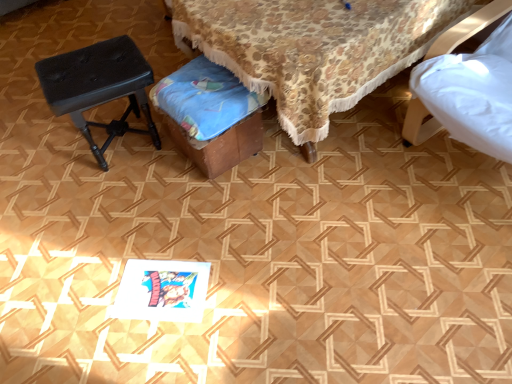
This screenshot has height=384, width=512. What do you see at coordinates (210, 115) in the screenshot?
I see `wooden music stool at center` at bounding box center [210, 115].

This screenshot has height=384, width=512. In order to click on black leather stool at left in this screenshot , I will do `click(99, 87)`.

Is wooden music stool at center positioned beyond the bounds of black leather stool at left?

Yes, wooden music stool at center is not within black leather stool at left.

Between wooden music stool at center and black leather stool at left, which one is positioned in front?

wooden music stool at center is more forward.

Is wooden music stool at center shorter than black leather stool at left?

Indeed, wooden music stool at center has a lesser height compared to black leather stool at left.

What are the coordinates of `music stool in front of the black leather stool at left` in the screenshot? It's located at (210, 115).

Based on the photo, is black leather stool at left taller or shorter than wooden stool at center?

Clearly, black leather stool at left is shorter compared to wooden stool at center.

Could you tell me if black leather stool at left is facing wooden stool at center?

No, black leather stool at left is not oriented towards wooden stool at center.

From the image's perspective, does black leather stool at left appear lower than wooden stool at center?

Yes.

Consider the image. From a real-world perspective, is black leather stool at left positioned under wooden stool at center based on gravity?

Yes, from a real-world perspective, black leather stool at left is beneath wooden stool at center.

Is point (216, 105) in front of point (243, 77)?

That is False.

In terms of height, does wooden music stool at center look taller or shorter compared to wooden stool at center?

In the image, wooden music stool at center appears to be shorter than wooden stool at center.

Is wooden music stool at center facing away from wooden stool at center?

Yes, wooden music stool at center's orientation is away from wooden stool at center.

Does wooden music stool at center appear on the right side of wooden stool at center?

Incorrect, wooden music stool at center is not on the right side of wooden stool at center.

From their relative heights in the image, would you say wooden stool at center is taller or shorter than wooden music stool at center?

In the image, wooden stool at center appears to be taller than wooden music stool at center.

Looking at the image, does wooden stool at center seem bigger or smaller compared to wooden music stool at center?

In the image, wooden stool at center appears to be larger than wooden music stool at center.

Is wooden stool at center thinner than wooden music stool at center?

No.

Is wooden stool at center taller than black leather stool at left?

Yes.

Is wooden stool at center positioned far away from black leather stool at left?

That's not correct — wooden stool at center is a little close to black leather stool at left.

Looking at this image, is black leather stool at left at the back of wooden stool at center?

That's not correct — wooden stool at center is not looking away from black leather stool at left.

From the image's perspective, which object appears higher, black leather stool at left or wooden music stool at center?

black leather stool at left is shown above in the image.

Can you tell me how much black leather stool at left and wooden music stool at center differ in facing direction?

black leather stool at left and wooden music stool at center are facing 11 degrees away from each other.

Is black leather stool at left aimed at wooden music stool at center?

No, black leather stool at left is not aimed at wooden music stool at center.

Find the location of `stool positioned vertically above the wooden music stool at center (from a real-world perspective)`. stool positioned vertically above the wooden music stool at center (from a real-world perspective) is located at coordinates (99, 87).

You are a GUI agent. You are given a task and a screenshot of the screen. Output one action in this format:
    pyautogui.click(x=<x>, y=<y>)
    Task: Click on the furniture to the right of black leather stool at left
    This screenshot has height=384, width=512.
    Given the screenshot: What is the action you would take?
    pyautogui.click(x=313, y=49)

Which object lies further to the anchor point wooden music stool at center, wooden stool at center or black leather stool at left?

black leather stool at left lies further to wooden music stool at center than the other object.

When comparing their distances from wooden music stool at center, does black leather stool at left or wooden stool at center seem closer?

Among the two, wooden stool at center is located nearer to wooden music stool at center.

Considering their positions, is wooden stool at center positioned closer to black leather stool at left than wooden music stool at center?

Among the two, wooden music stool at center is located nearer to black leather stool at left.

Considering their positions, is wooden music stool at center positioned closer to wooden stool at center than black leather stool at left?

wooden music stool at center lies closer to wooden stool at center than the other object.

Considering their positions, is black leather stool at left positioned further to wooden stool at center than wooden music stool at center?

The object further to wooden stool at center is black leather stool at left.

Looking at the image, which one is located closer to black leather stool at left, wooden music stool at center or wooden stool at center?

wooden music stool at center lies closer to black leather stool at left than the other object.

Identify the location of music stool between black leather stool at left and wooden stool at center from left to right. (210, 115).